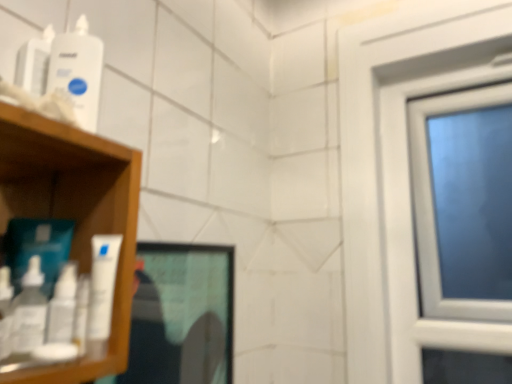
Question: Is white plastic bottle at upper left, which is the first mouthwash in top-to-bottom order, bigger than white glossy tube at left, the 2th mouthwash viewed from the top?

Choices:
 (A) yes
 (B) no

Answer: (A)

Question: From the image's perspective, does white plastic bottle at upper left, which is the first mouthwash in top-to-bottom order, appear lower than white glossy tube at left, the 2th mouthwash viewed from the top?

Choices:
 (A) yes
 (B) no

Answer: (B)

Question: Is white plastic bottle at upper left, which is the first mouthwash in top-to-bottom order, with white glossy tube at left, the 2th mouthwash viewed from the top?

Choices:
 (A) no
 (B) yes

Answer: (A)

Question: Does white plastic bottle at upper left, the 3th mouthwash positioned from the bottom, appear on the right side of white glossy tube at left, the second mouthwash ordered from the bottom?

Choices:
 (A) no
 (B) yes

Answer: (A)

Question: Is white plastic bottle at upper left, the 3th mouthwash positioned from the bottom, further to the viewer compared to white glossy tube at left, the second mouthwash ordered from the bottom?

Choices:
 (A) no
 (B) yes

Answer: (B)

Question: Is white glossy tube at left, the 2th mouthwash viewed from the top, situated inside white plastic bottle at upper left, which is the first mouthwash in top-to-bottom order, or outside?

Choices:
 (A) inside
 (B) outside

Answer: (B)

Question: Considering the positions of white glossy tube at left, the 2th mouthwash viewed from the top, and white plastic bottle at upper left, which is the first mouthwash in top-to-bottom order, in the image, is white glossy tube at left, the 2th mouthwash viewed from the top, bigger or smaller than white plastic bottle at upper left, which is the first mouthwash in top-to-bottom order,?

Choices:
 (A) small
 (B) big

Answer: (A)

Question: Is point click(109, 269) closer or farther from the camera than point click(86, 26)?

Choices:
 (A) farther
 (B) closer

Answer: (B)

Question: From a real-world perspective, is white glossy tube at left, the second mouthwash ordered from the bottom, physically located above or below white plastic bottle at upper left, the 3th mouthwash positioned from the bottom?

Choices:
 (A) below
 (B) above

Answer: (A)

Question: Considering the relative positions of white glossy mouthwash at left, placed as the third mouthwash when sorted from top to bottom, and white glossy tube at left, the 2th mouthwash viewed from the top, in the image provided, is white glossy mouthwash at left, placed as the third mouthwash when sorted from top to bottom, to the left or to the right of white glossy tube at left, the 2th mouthwash viewed from the top,?

Choices:
 (A) right
 (B) left

Answer: (B)

Question: From a real-world perspective, is white glossy mouthwash at left, which is the 1th mouthwash in bottom-to-top order, positioned above or below white glossy tube at left, the second mouthwash ordered from the bottom?

Choices:
 (A) below
 (B) above

Answer: (A)

Question: From the image's perspective, is white glossy mouthwash at left, which is the 1th mouthwash in bottom-to-top order, located above or below white glossy tube at left, the second mouthwash ordered from the bottom?

Choices:
 (A) below
 (B) above

Answer: (A)

Question: Choose the correct answer: Is white glossy mouthwash at left, placed as the third mouthwash when sorted from top to bottom, inside white glossy tube at left, the 2th mouthwash viewed from the top, or outside it?

Choices:
 (A) inside
 (B) outside

Answer: (B)

Question: Considering the positions of white glossy tube at left, the 2th mouthwash viewed from the top, and white glossy mouthwash at left, placed as the third mouthwash when sorted from top to bottom, in the image, is white glossy tube at left, the 2th mouthwash viewed from the top, bigger or smaller than white glossy mouthwash at left, placed as the third mouthwash when sorted from top to bottom,?

Choices:
 (A) big
 (B) small

Answer: (A)

Question: Considering the positions of point [x=90, y=337] and point [x=17, y=324], is point [x=90, y=337] closer or farther from the camera than point [x=17, y=324]?

Choices:
 (A) closer
 (B) farther

Answer: (B)